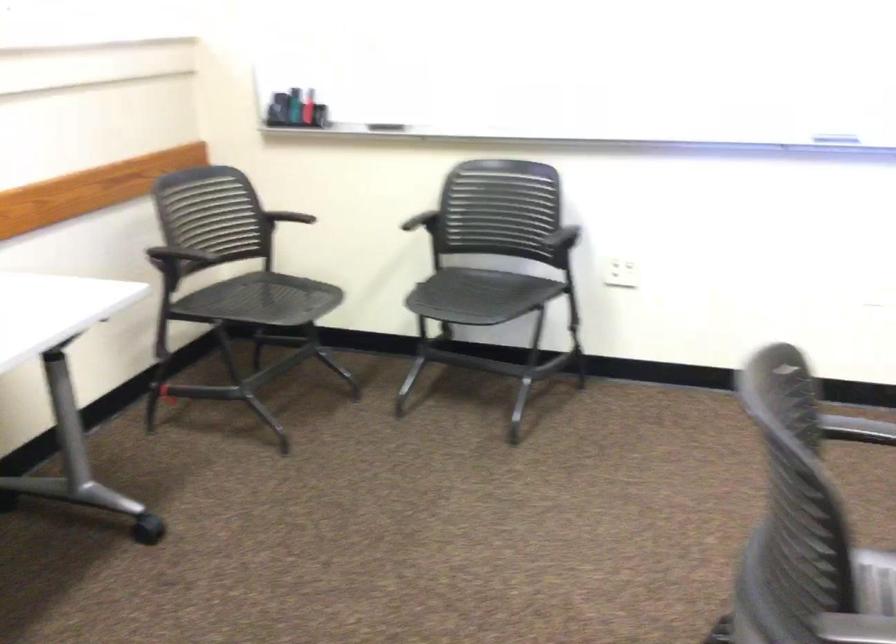
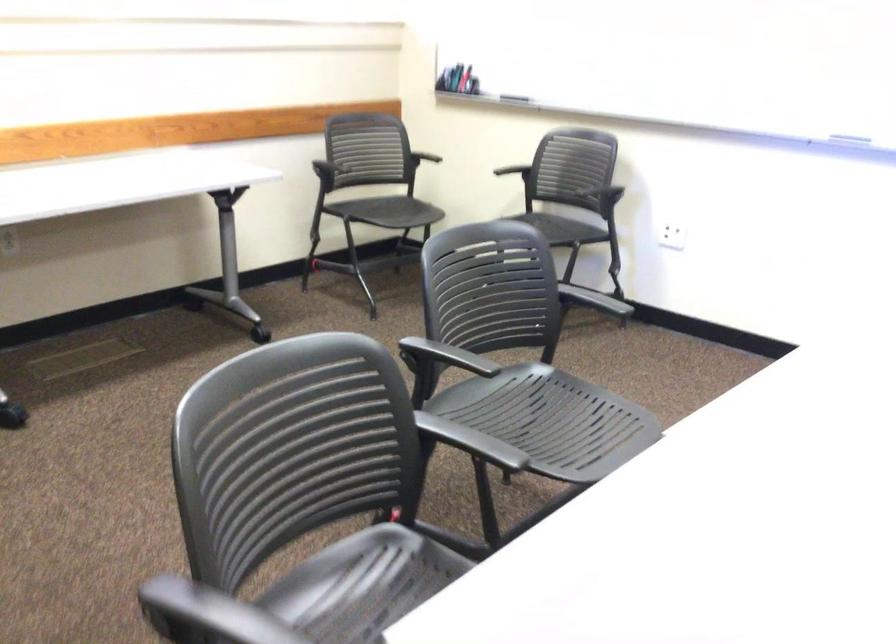
Where in the second image is the point corresponding to (391,138) from the first image?

(514, 98)